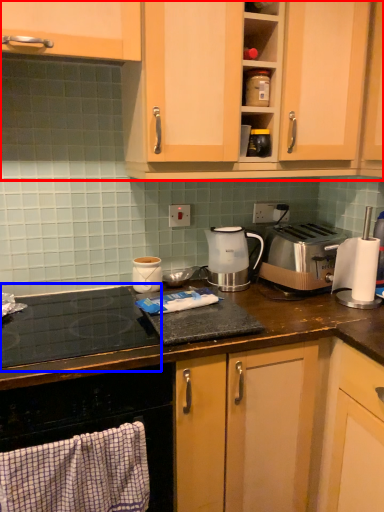
Question: Which object is further to the camera taking this photo, cabinetry (highlighted by a red box) or gas stove (highlighted by a blue box)?

Choices:
 (A) cabinetry
 (B) gas stove

Answer: (A)